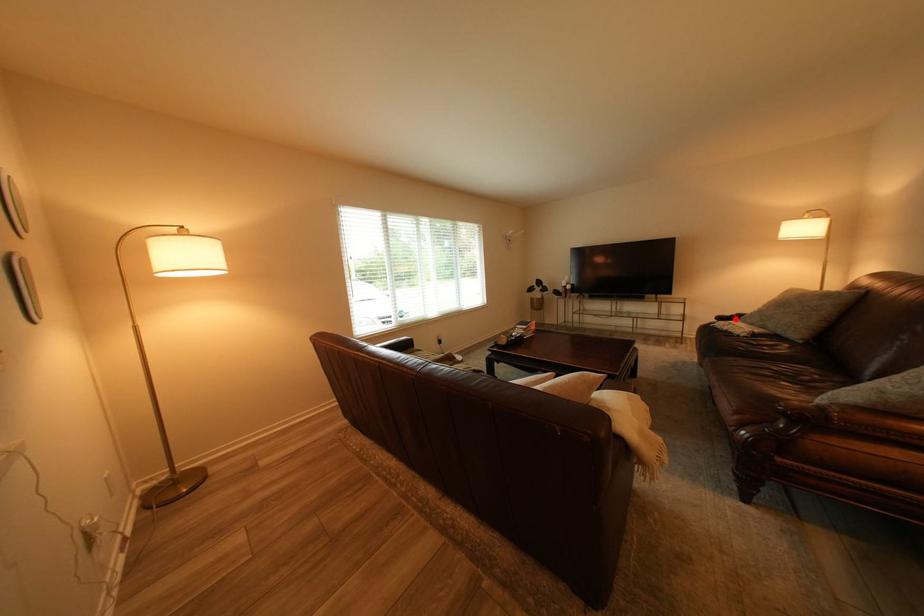
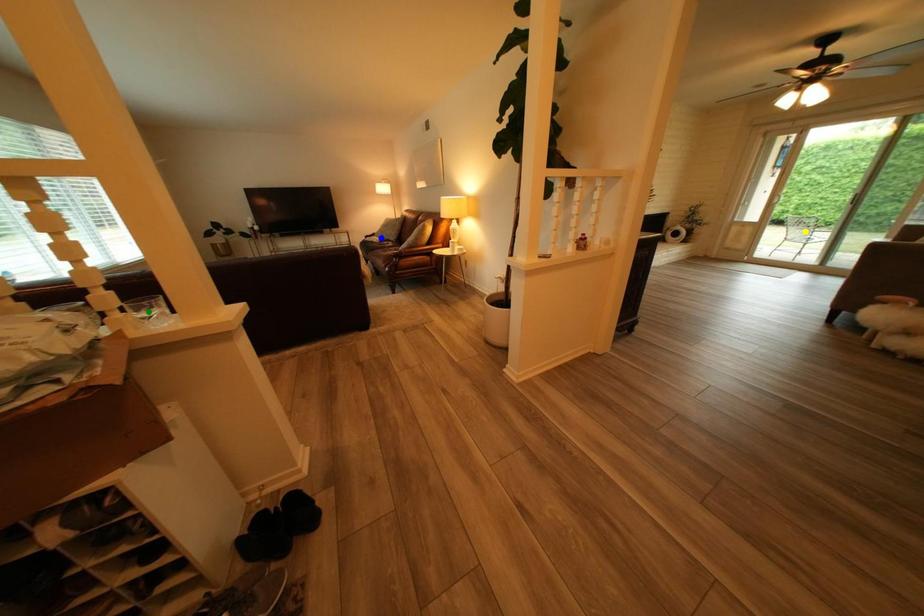
Question: I am providing you with two images of the same scene from different viewpoints. A red point is marked on the first image. You are given multiple points on the second image. Which spot in image 2 lines up with the point in image 1?

Choices:
 (A) yellow point
 (B) blue point
 (C) green point

Answer: (B)